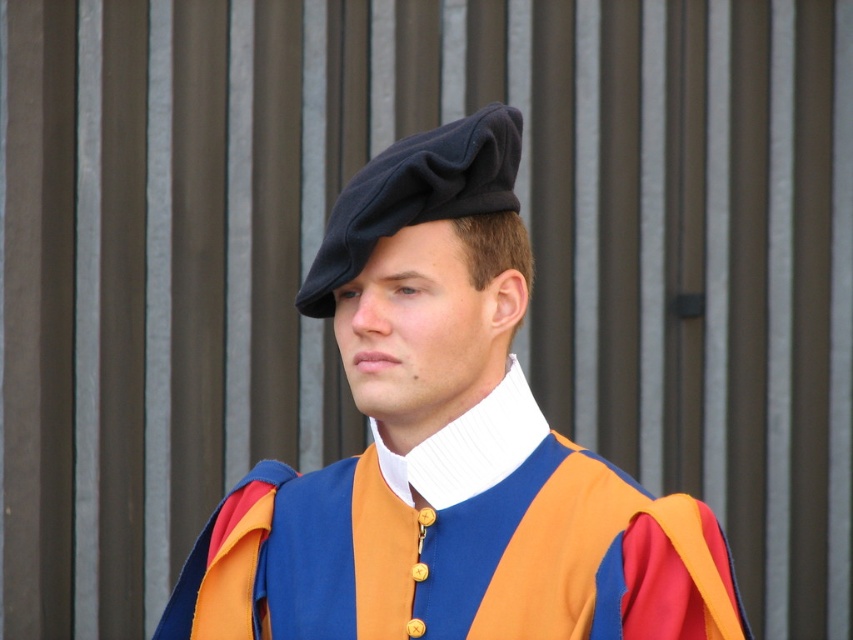
Question: Can you confirm if matte black beret at center is smaller than black felt beret at center?

Choices:
 (A) yes
 (B) no

Answer: (B)

Question: Can you confirm if matte black beret at center is smaller than black felt beret at center?

Choices:
 (A) yes
 (B) no

Answer: (B)

Question: Which point is farther from the camera taking this photo?

Choices:
 (A) (546, 449)
 (B) (363, 225)

Answer: (A)

Question: Is matte black beret at center below black felt beret at center?

Choices:
 (A) no
 (B) yes

Answer: (B)

Question: Among these points, which one is farthest from the camera?

Choices:
 (A) (263, 499)
 (B) (482, 147)

Answer: (A)